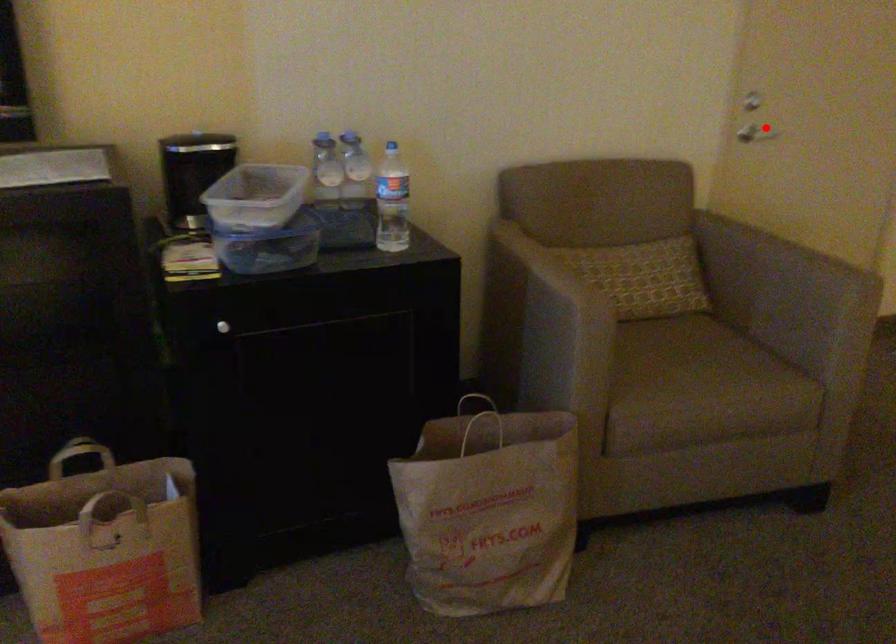
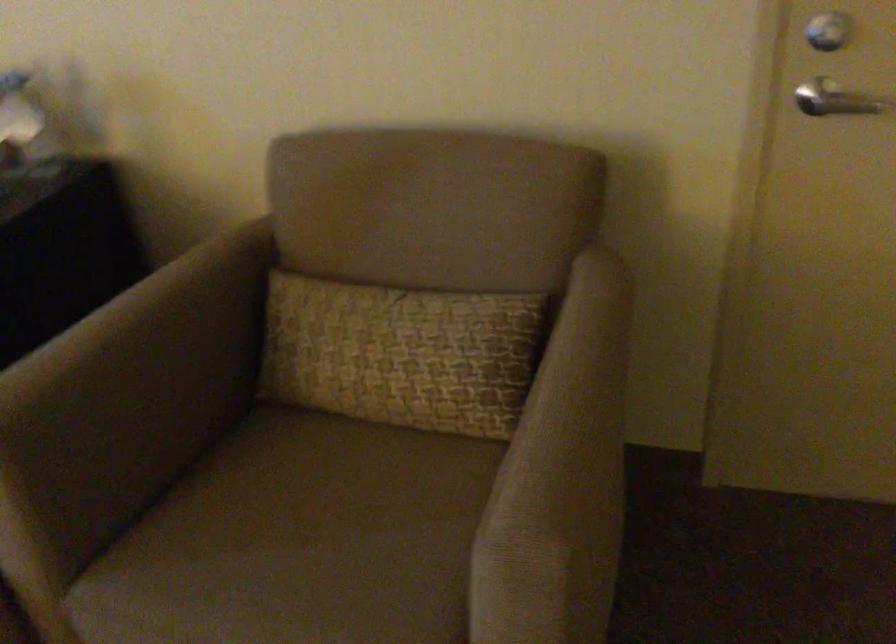
In the second image, find the point that corresponds to the highlighted location in the first image.

(840, 102)